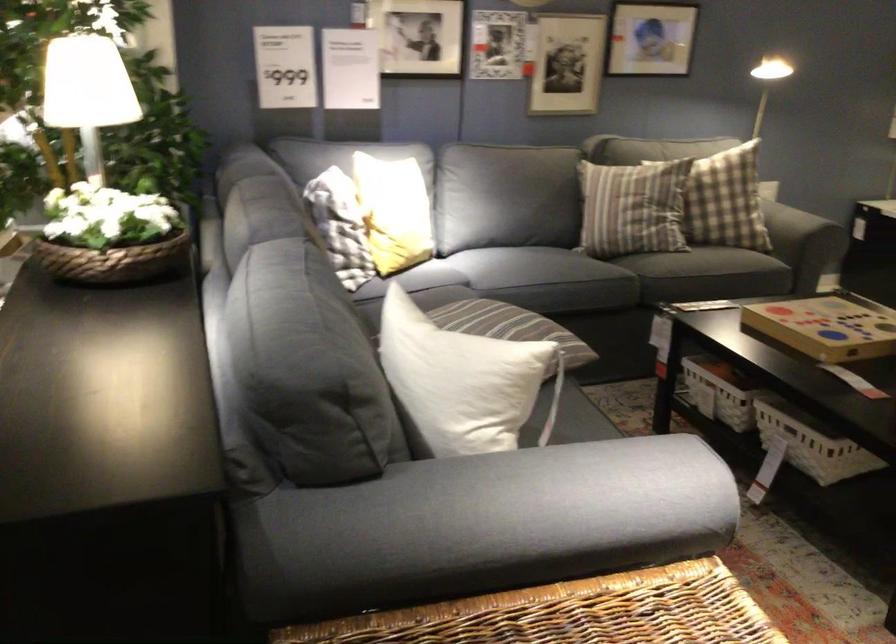
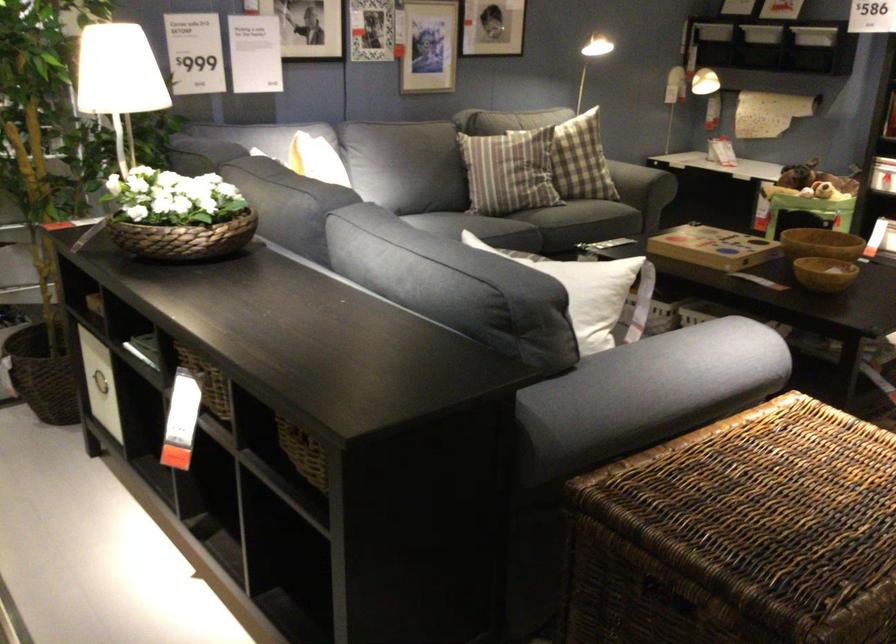
Where in the second image is the point corresponding to (478,351) from the first image?

(581, 272)